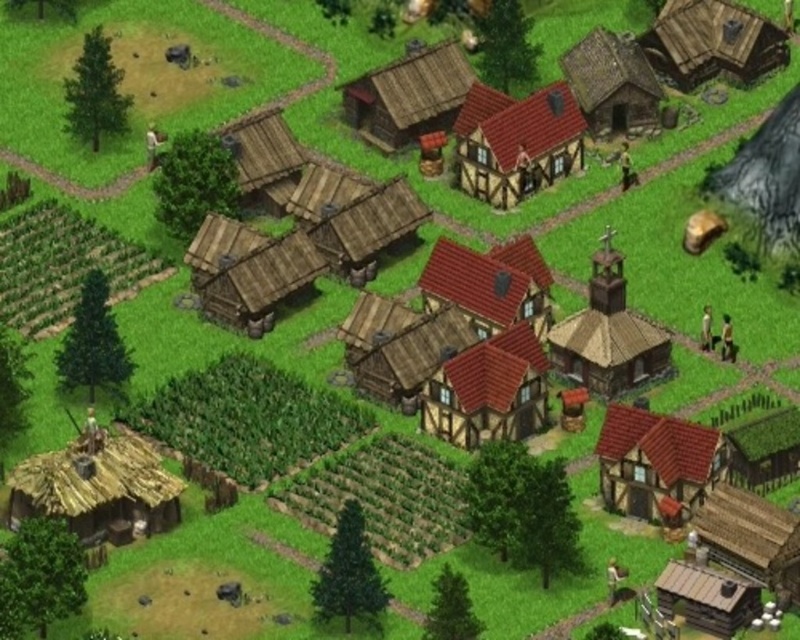
You are navigating a medieval village from a top view and need to locate the rustic wooden hut at upper right. According to the map coordinates, where is it positioned?

The rustic wooden hut at upper right is located at point (612, 84).

You are standing at point (516, 141) in the village. What type of building are you currently located at?

You are at a brown wooden house at center located at point (516, 141).